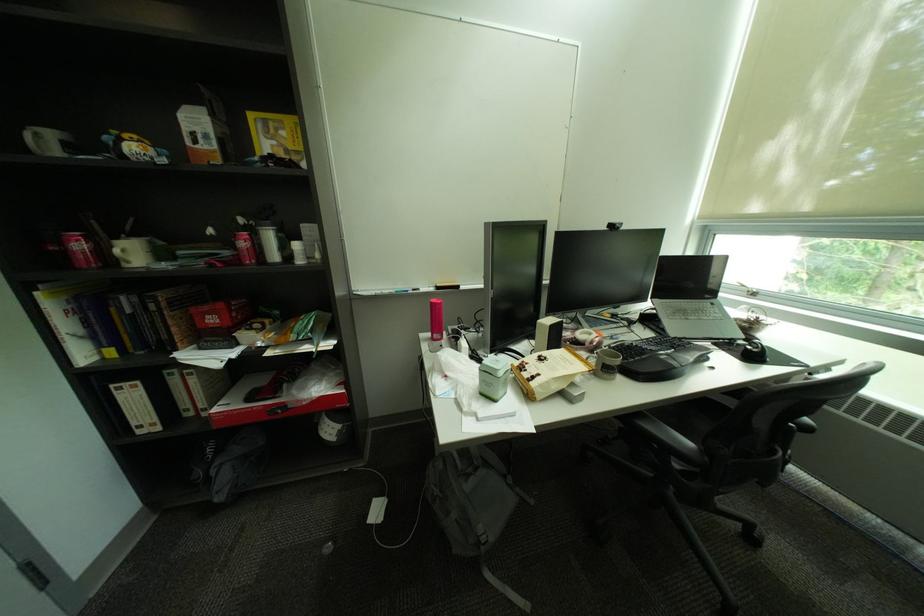
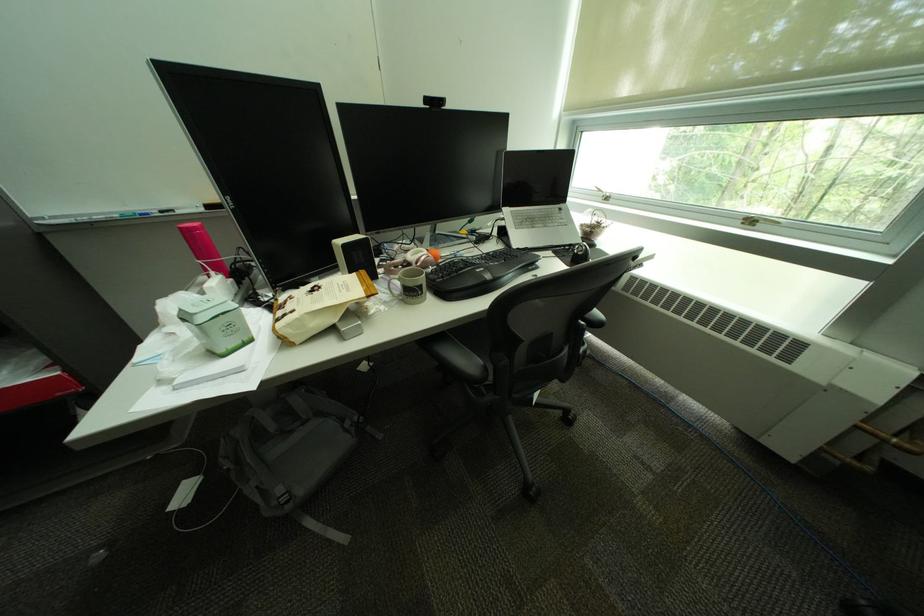
Locate, in the second image, the point that corresponds to [443,304] in the first image.

(190, 230)